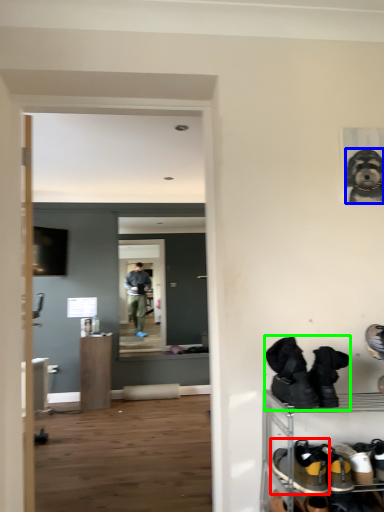
Question: Estimate the real-world distances between objects in this image. Which object is farther from footwear (highlighted by a red box), dog (highlighted by a blue box) or footwear (highlighted by a green box)?

Choices:
 (A) dog
 (B) footwear

Answer: (A)